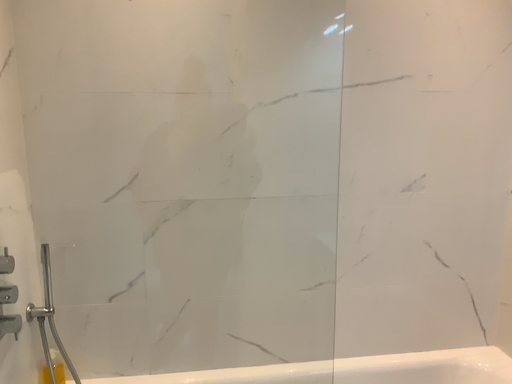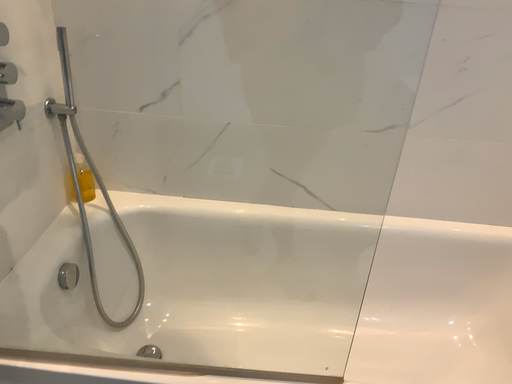
Question: Which way did the camera rotate in the video?

Choices:
 (A) rotated left
 (B) rotated right

Answer: (A)